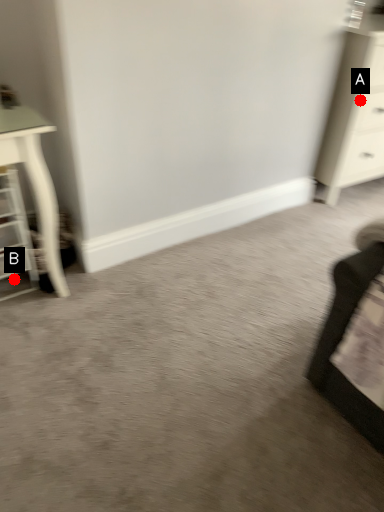
Question: Two points are circled on the image, labeled by A and B beside each circle. Which point appears farthest from the camera in this image?

Choices:
 (A) A is further
 (B) B is further

Answer: (A)